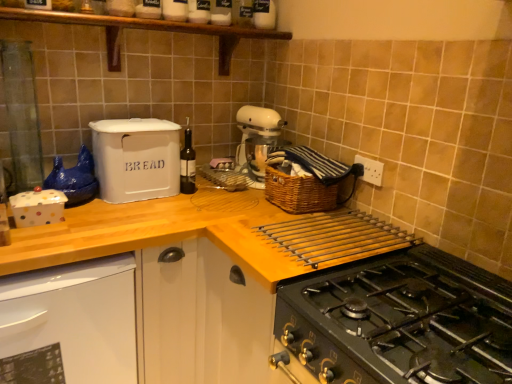
You are a GUI agent. You are given a task and a screenshot of the screen. Output one action in this format:
    pyautogui.click(x=<x>, y=<y>)
    Task: Click on the empty space that is ontop of woven brown basket at upper right (from a real-world perspective)
    The height and width of the screenshot is (384, 512).
    Given the screenshot: What is the action you would take?
    pyautogui.click(x=296, y=167)